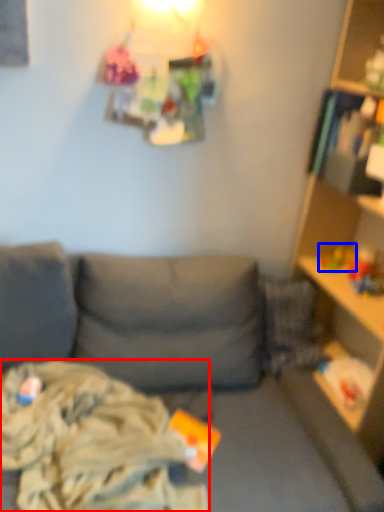
Question: Among these objects, which one is farthest to the camera, clothing (highlighted by a red box) or toy (highlighted by a blue box)?

Choices:
 (A) clothing
 (B) toy

Answer: (B)